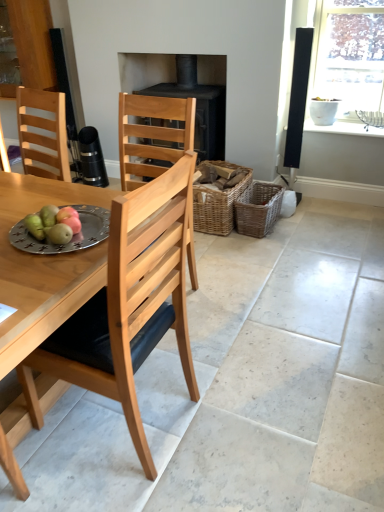
This screenshot has height=512, width=384. I want to click on vacant space to the right of natural wood chair at center, so click(228, 414).